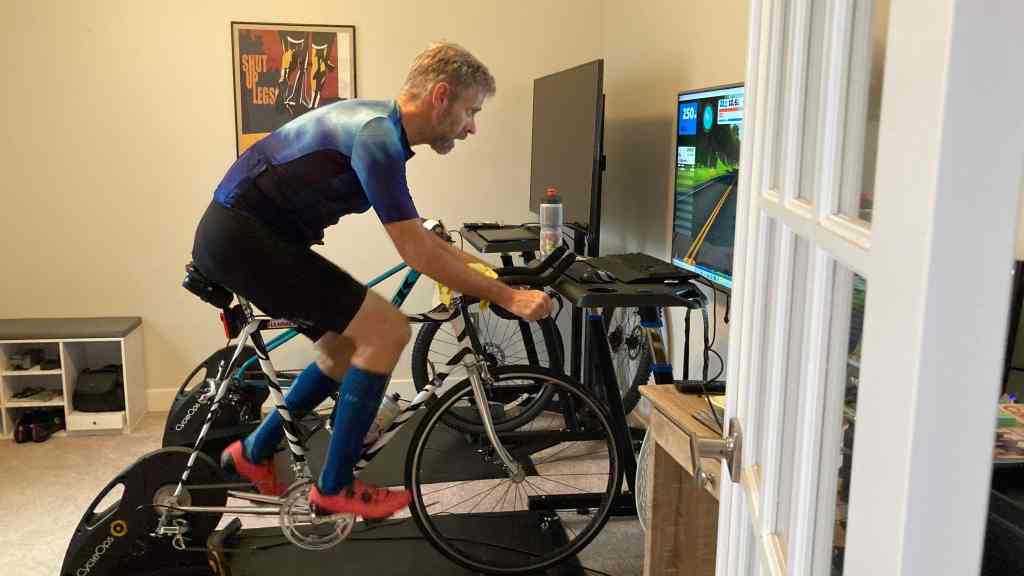
At what (x,y) coordinates should I click in order to perform the action: click on shoe organizer. Please return your answer as a coordinate pair (x, y). Looking at the image, I should click on (30, 384).